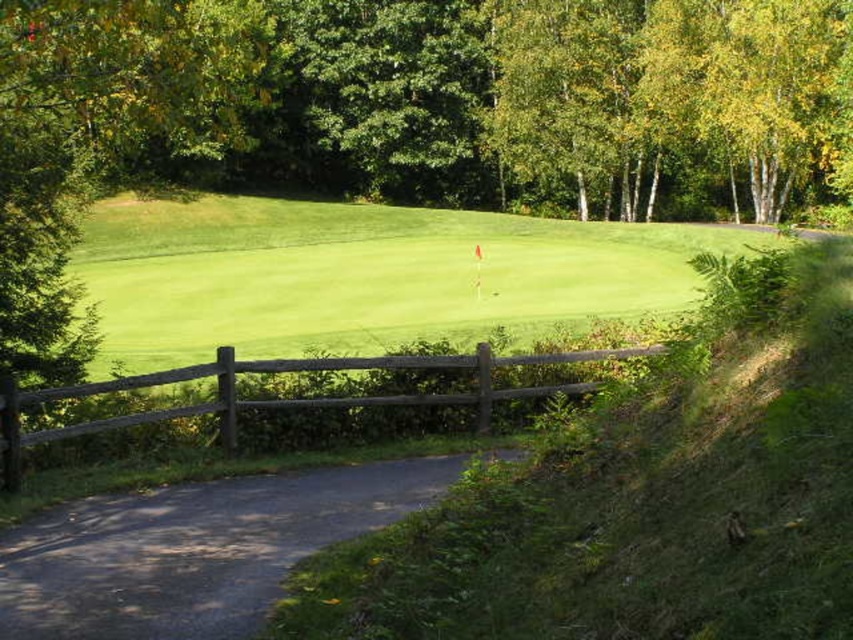
You are a golfer standing at the edge of the putting green and want to hit the ball to the hole marked by the red flag. You notice two points on the slope near the green. Which point, point 1 at coordinates (364, 284) or point 2 at (308, 397), is closer to you?

Point 2 at (308, 397) is closer to you because point 1 at (364, 284) is further to the camera than point 2 at (308, 397).

You are a golfer standing on the paved pathway and want to hit a ball onto the green grassy golf course at center. Considering the brown wooden fence at center is between you and the golf course, can you hit the ball over the fence to reach the golf course?

The green grassy golf course at center is wider than the brown wooden fence at center, so yes, you can hit the ball over the fence to reach the golf course since the golf course is wider.

You are a golfer standing at the tee box. You need to decide whether to hit your ball towards the green grassy golf course at center or the dark gray asphalt road at lower left. Which option has a wider area to land your ball?

The green grassy golf course at center has a wider area than the dark gray asphalt road at lower left, so it is better to aim for the green grassy golf course at center.